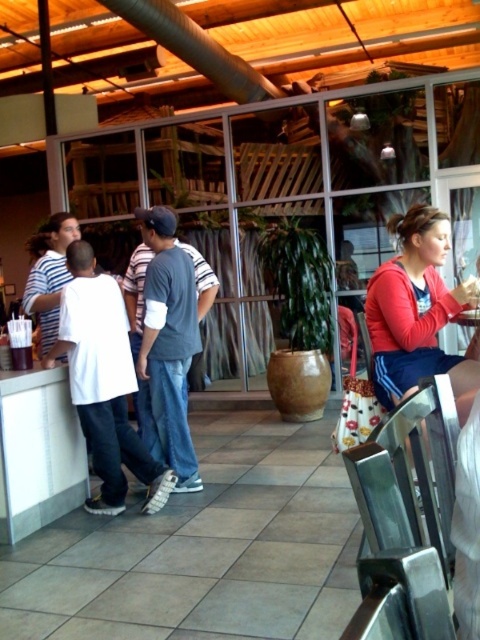
You are a customer sitting at a table in the center of the room and you see a red fleece jacket at right and a gray cotton shirt at center. Which clothing item is closer to your left side?

The gray cotton shirt at center is closer to your left side because it is positioned at the center, while the red fleece jacket at right is further to the right.